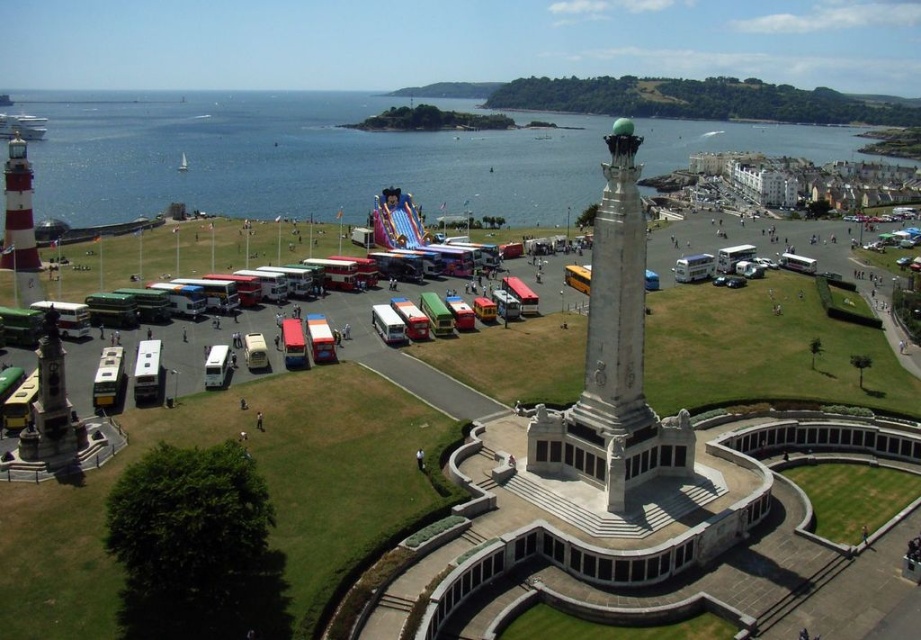
Between blue water at upper center and white marble monument at center, which one is positioned lower?

white marble monument at center is below.

Is point (191, 163) positioned before point (616, 300)?

No.

This screenshot has height=640, width=921. Find the location of `blue water at upper center`. blue water at upper center is located at coordinates (296, 157).

Does white marble monument at center have a smaller size compared to polished stone monument at lower left?

Actually, white marble monument at center might be larger than polished stone monument at lower left.

Which is behind, point (647, 454) or point (55, 316)?

The point (647, 454) is behind.

Looking at this image, who is more distant from viewer, (630, 467) or (41, 356)?

Point (630, 467)

Identify the location of white marble monument at center. (613, 358).

You are a GUI agent. You are given a task and a screenshot of the screen. Output one action in this format:
    pyautogui.click(x=<x>, y=<y>)
    Task: Click on the blue water at upper center
    
    Given the screenshot: What is the action you would take?
    pyautogui.click(x=296, y=157)

Between blue water at upper center and polished stone monument at lower left, which one appears on the left side from the viewer's perspective?

From the viewer's perspective, polished stone monument at lower left appears more on the left side.

Is point (476, 164) behind point (55, 353)?

Yes, it is behind point (55, 353).

This screenshot has height=640, width=921. In order to click on blue water at upper center in this screenshot , I will do `click(296, 157)`.